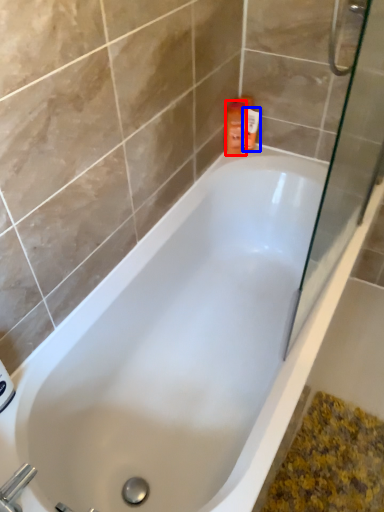
Question: Among these objects, which one is nearest to the camera, cleaning product (highlighted by a red box) or toiletry (highlighted by a blue box)?

Choices:
 (A) cleaning product
 (B) toiletry

Answer: (A)